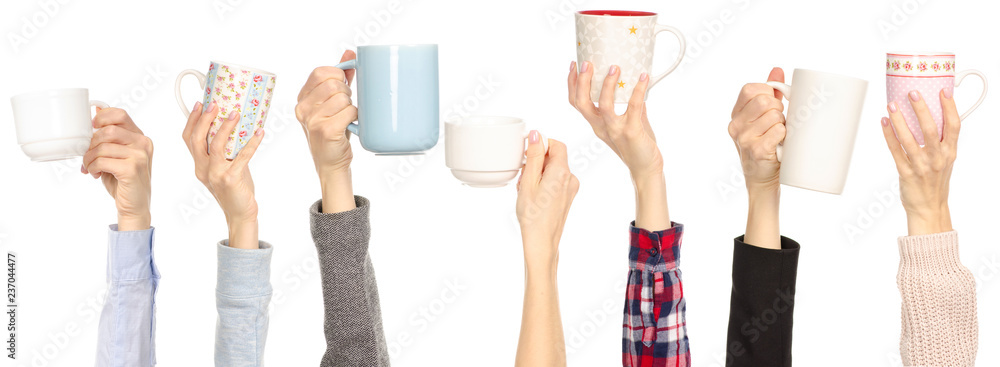
Where is `mug`? This screenshot has height=367, width=1000. mug is located at coordinates (509, 130), (394, 98), (624, 49), (816, 107), (910, 88), (250, 86), (80, 111).